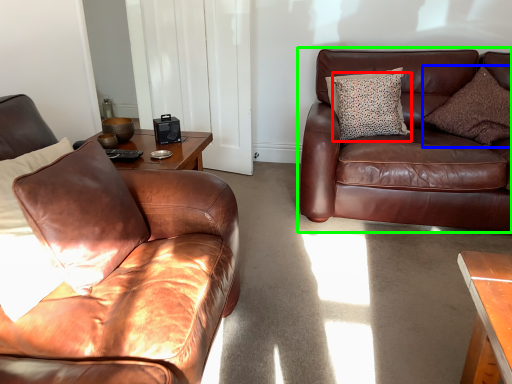
Question: Which is nearer to the pillow (highlighted by a red box)? pillow (highlighted by a blue box) or studio couch (highlighted by a green box).

Choices:
 (A) pillow
 (B) studio couch

Answer: (B)